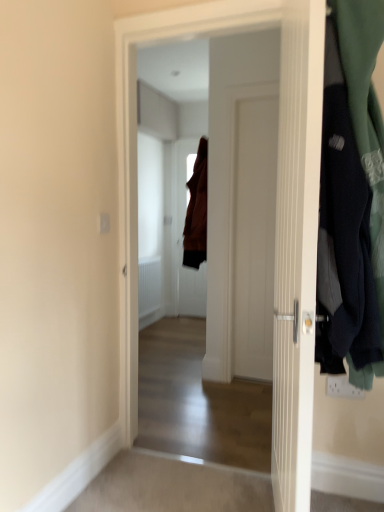
Question: Can brown fabric door at center, which ranks as the first door in back-to-front order, be found inside white wooden door at center, arranged as the second door when viewed from the front?

Choices:
 (A) no
 (B) yes

Answer: (A)

Question: From the image's perspective, is white wooden door at center, arranged as the second door when viewed from the front, below brown fabric door at center, which ranks as the first door in back-to-front order?

Choices:
 (A) yes
 (B) no

Answer: (A)

Question: Is white wooden door at center, arranged as the second door when viewed from the front, next to brown fabric door at center, which appears as the 3th door when viewed from the front, and touching it?

Choices:
 (A) yes
 (B) no

Answer: (B)

Question: Considering the relative sizes of white wooden door at center, the 2th door positioned from the back, and brown fabric door at center, which ranks as the first door in back-to-front order, in the image provided, is white wooden door at center, the 2th door positioned from the back, taller than brown fabric door at center, which ranks as the first door in back-to-front order,?

Choices:
 (A) yes
 (B) no

Answer: (A)

Question: Are white wooden door at center, arranged as the second door when viewed from the front, and brown fabric door at center, which appears as the 3th door when viewed from the front, located far from each other?

Choices:
 (A) yes
 (B) no

Answer: (A)

Question: Is white wooden door at center, the 2th door positioned from the back, outside of brown fabric door at center, which ranks as the first door in back-to-front order?

Choices:
 (A) no
 (B) yes

Answer: (B)

Question: Is white wooden door at center, acting as the 1th door starting from the front, oriented away from brown fabric door at center, which ranks as the first door in back-to-front order?

Choices:
 (A) yes
 (B) no

Answer: (B)

Question: Is white wooden door at center, which appears as the 3th door when viewed from the back, positioned beyond the bounds of brown fabric door at center, which ranks as the first door in back-to-front order?

Choices:
 (A) yes
 (B) no

Answer: (A)

Question: Is brown fabric door at center, which appears as the 3th door when viewed from the front, inside white wooden door at center, which appears as the 3th door when viewed from the back?

Choices:
 (A) yes
 (B) no

Answer: (B)

Question: Can you confirm if white wooden door at center, acting as the 1th door starting from the front, is smaller than brown fabric door at center, which appears as the 3th door when viewed from the front?

Choices:
 (A) no
 (B) yes

Answer: (A)

Question: Does white wooden door at center, which appears as the 3th door when viewed from the back, have a lesser width compared to brown fabric door at center, which appears as the 3th door when viewed from the front?

Choices:
 (A) no
 (B) yes

Answer: (A)

Question: Can you confirm if white wooden door at center, which appears as the 3th door when viewed from the back, is wider than brown fabric door at center, which appears as the 3th door when viewed from the front?

Choices:
 (A) no
 (B) yes

Answer: (B)

Question: Considering the relative sizes of brown fabric door at center, which appears as the 3th door when viewed from the front, and white wooden door at center, arranged as the second door when viewed from the front, in the image provided, is brown fabric door at center, which appears as the 3th door when viewed from the front, wider than white wooden door at center, arranged as the second door when viewed from the front,?

Choices:
 (A) no
 (B) yes

Answer: (A)